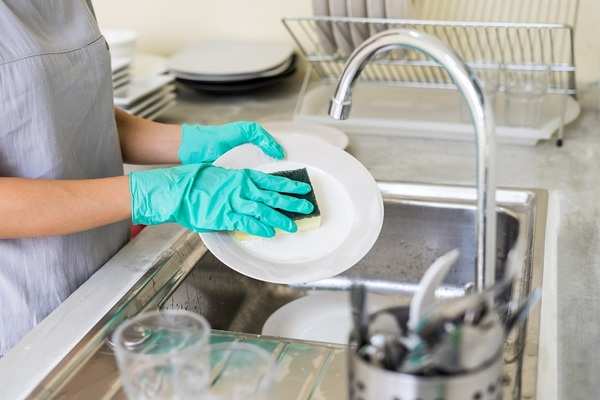
This screenshot has width=600, height=400. In order to click on glass cup in this screenshot , I will do `click(171, 340)`, `click(237, 372)`, `click(489, 72)`, `click(531, 83)`.